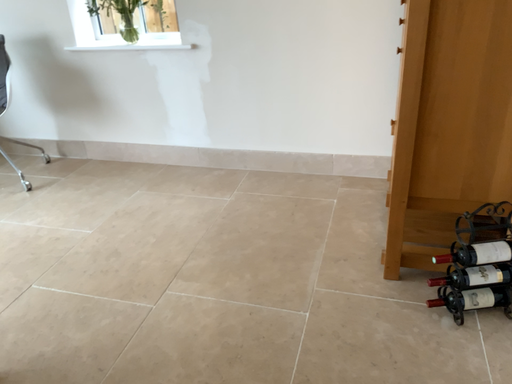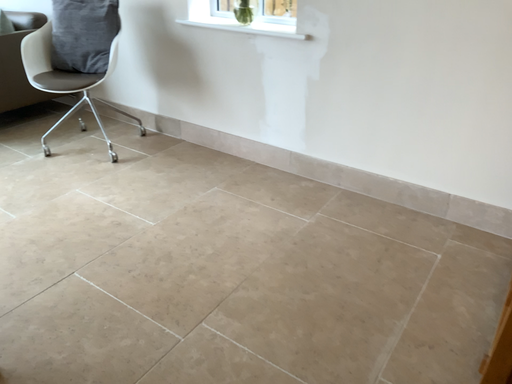
Question: Which way did the camera rotate in the video?

Choices:
 (A) rotated left
 (B) rotated right

Answer: (A)